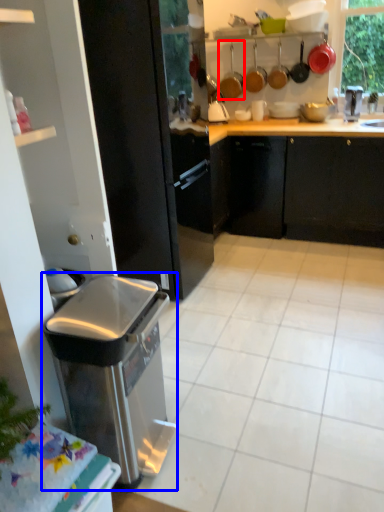
Question: Which object is closer to the camera taking this photo, appliance (highlighted by a red box) or home appliance (highlighted by a blue box)?

Choices:
 (A) appliance
 (B) home appliance

Answer: (B)